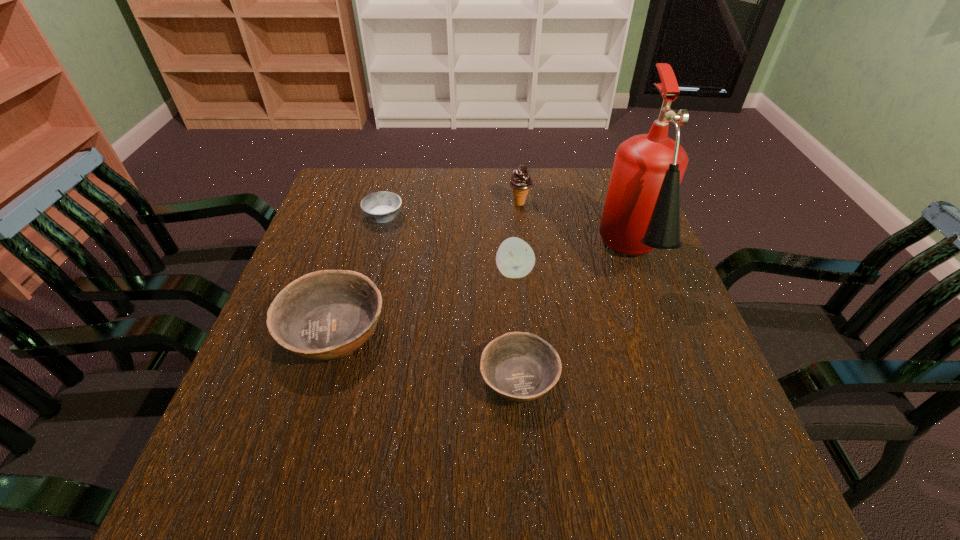
Identify the location of free area in between the icecream and the shorter bowl. (519, 291).

Image resolution: width=960 pixels, height=540 pixels. I want to click on empty space that is in between the taller bowl and the icecream, so click(x=427, y=267).

Image resolution: width=960 pixels, height=540 pixels. Identify the location of empty space that is in between the apple and the right bowl. (516, 325).

You are a GUI agent. You are given a task and a screenshot of the screen. Output one action in this format:
    pyautogui.click(x=<x>, y=<y>)
    Task: Click on the vacant region between the apple and the shorter bowl
    The height and width of the screenshot is (540, 960).
    Given the screenshot: What is the action you would take?
    pyautogui.click(x=516, y=325)

The height and width of the screenshot is (540, 960). What are the coordinates of `vacant space that is in between the tallest object and the left bowl` in the screenshot? It's located at (483, 295).

Identify which object is located as the fifth nearest to the apple. Please provide its 2D coordinates. Your answer should be formatted as a tuple, i.e. [(x, y)], where the tuple contains the x and y coordinates of a point satisfying the conditions above.

[(381, 207)]

Image resolution: width=960 pixels, height=540 pixels. What are the coordinates of `the fifth closest object to the rightmost object` in the screenshot? It's located at (381, 207).

This screenshot has height=540, width=960. Find the location of `free spot that satisfies the following two spatial constraints: 1. on the back side of the shorter bowl; 2. on the right side of the apple`. free spot that satisfies the following two spatial constraints: 1. on the back side of the shorter bowl; 2. on the right side of the apple is located at coordinates (511, 272).

Where is `free space that satisfies the following two spatial constraints: 1. on the back side of the ashtray; 2. on the right side of the icecream`? free space that satisfies the following two spatial constraints: 1. on the back side of the ashtray; 2. on the right side of the icecream is located at coordinates (387, 204).

I want to click on free space in the image that satisfies the following two spatial constraints: 1. on the back side of the second tallest object; 2. on the left side of the left bowl, so click(372, 204).